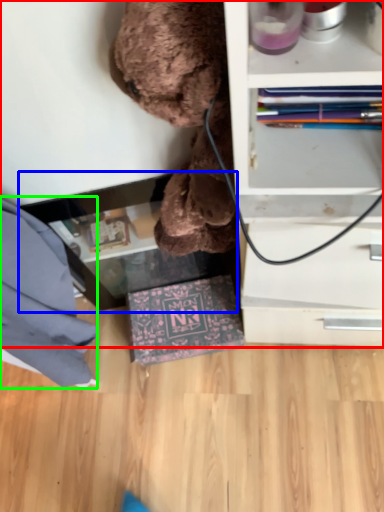
Question: Estimate the real-world distances between objects in this image. Which object is closer to shelf (highlighted by a red box), table (highlighted by a blue box) or clothe (highlighted by a green box)?

Choices:
 (A) table
 (B) clothe

Answer: (A)